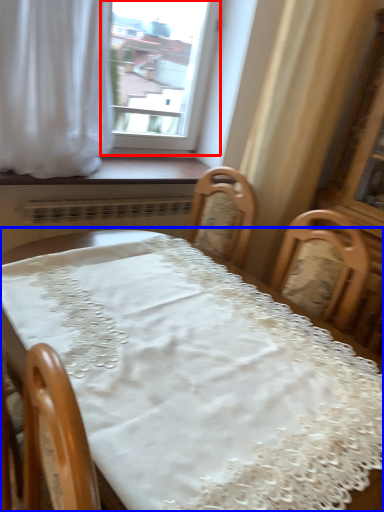
Question: Among these objects, which one is farthest to the camera, window (highlighted by a red box) or table (highlighted by a blue box)?

Choices:
 (A) window
 (B) table

Answer: (A)